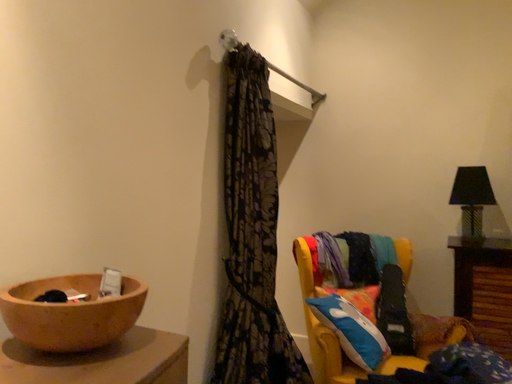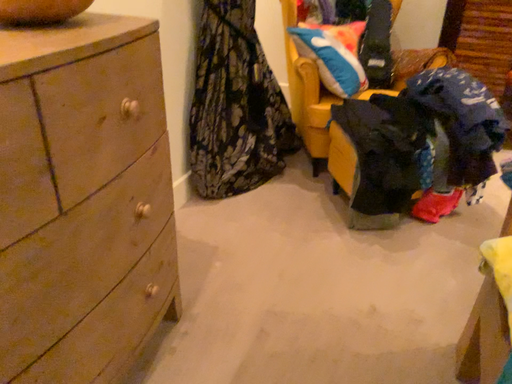
Question: How did the camera likely rotate when shooting the video?

Choices:
 (A) rotated downward
 (B) rotated upward

Answer: (A)